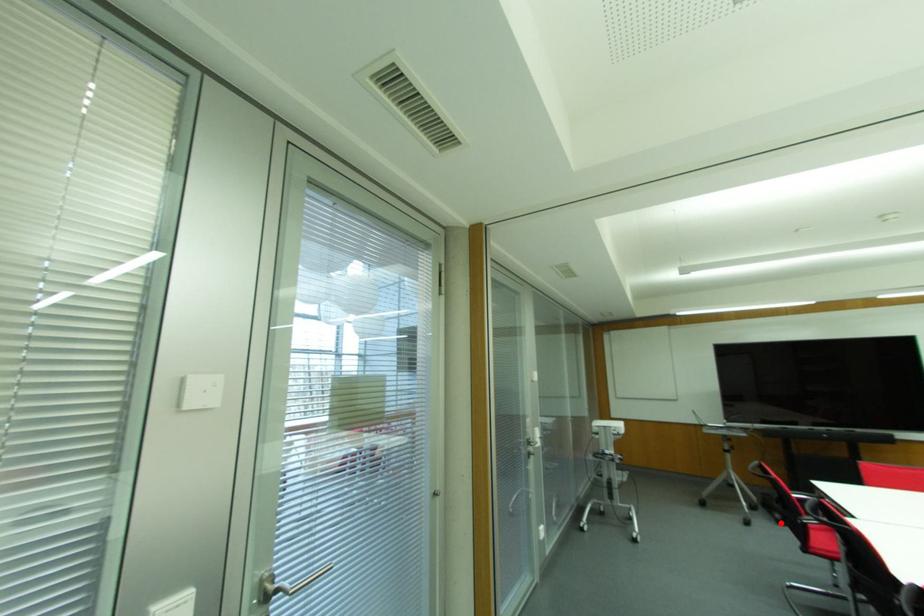
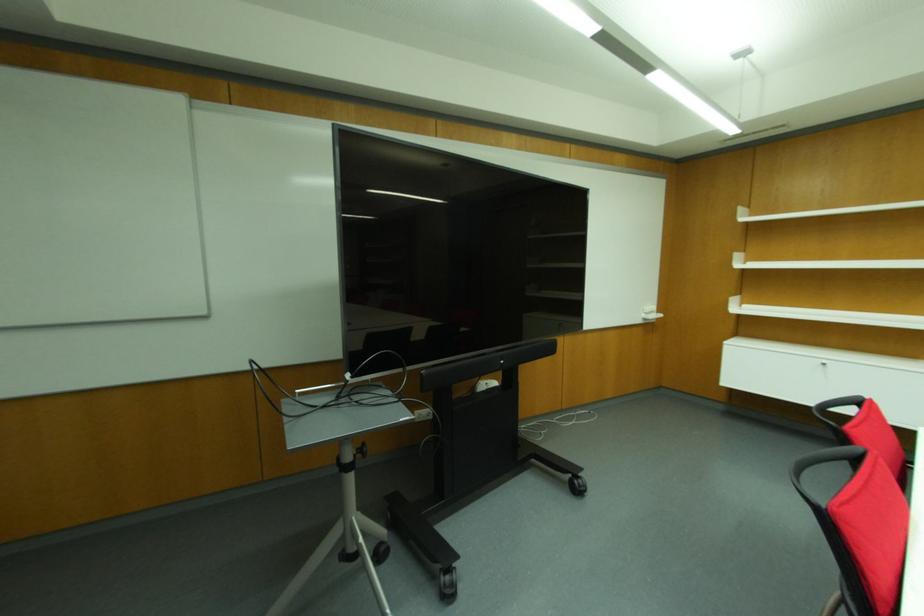
Question: I am providing you with two images of the same scene from different viewpoints. Image1 has a red point marked. In image2, the corresponding 3D location appears at what relative position? Reply with the corresponding letter.

Choices:
 (A) Closer
 (B) Farther

Answer: (A)